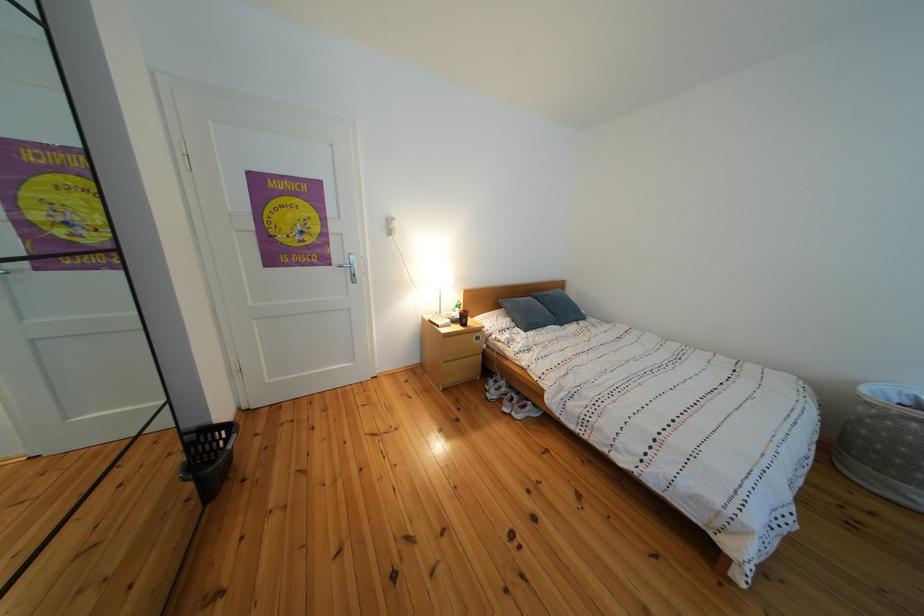
The location [438,321] corresponds to which object?

This point indicates the white smartphone.